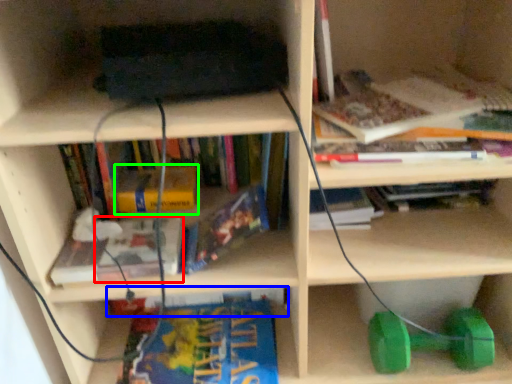
Question: Considering the real-world distances, which object is farthest from book (highlighted by a red box)? book (highlighted by a blue box) or book (highlighted by a green box)?

Choices:
 (A) book
 (B) book

Answer: (A)